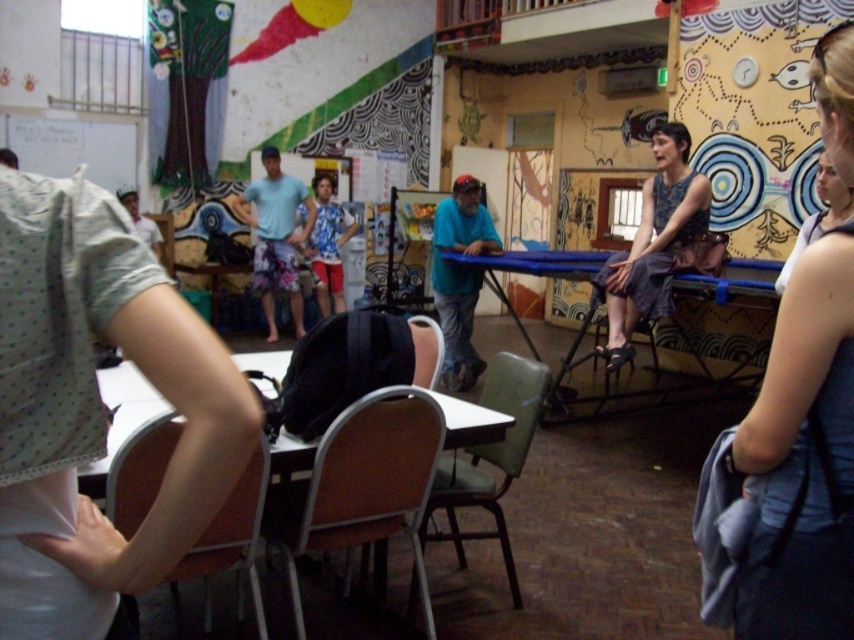
Question: Which object is farther from the camera taking this photo?

Choices:
 (A) brown wood chair at center
 (B) blue denim tank top at upper right
 (C) printed cotton tank top at center
 (D) brown wood chair at lower left

Answer: (C)

Question: Is brown wood chair at center in front of brown wood table at center?

Choices:
 (A) no
 (B) yes

Answer: (A)

Question: Which point appears closest to the camera in this image?

Choices:
 (A) (139, 445)
 (B) (504, 362)

Answer: (A)

Question: Which object is positioned farthest from the light blue t-shirt at center?

Choices:
 (A) brown wood table at center
 (B) printed cotton tank top at center
 (C) blue denim tank top at upper right
 (D) brown wood chair at lower left

Answer: (C)

Question: Can you confirm if blue plastic table at center is positioned to the right of brown leather chair at center?

Choices:
 (A) no
 (B) yes

Answer: (B)

Question: Does blue plastic table at center lie in front of brown leather chair at center?

Choices:
 (A) no
 (B) yes

Answer: (A)